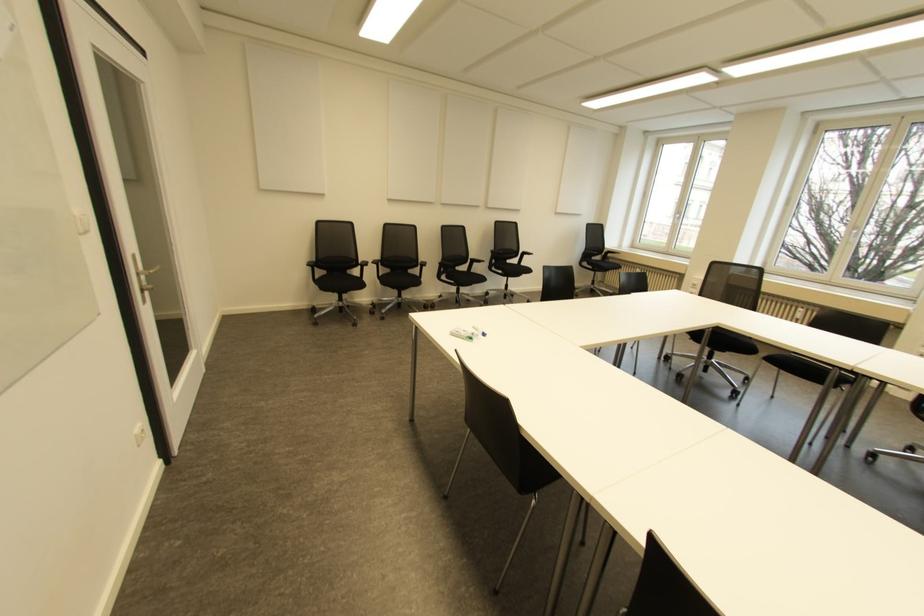
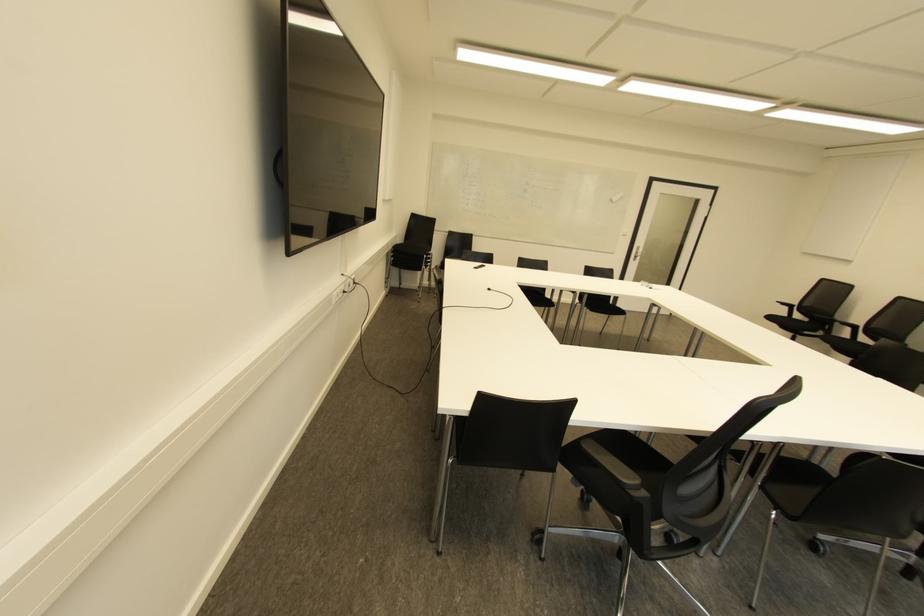
The point at (310,268) is marked in the first image. Where is the corresponding point in the second image?

(785, 307)